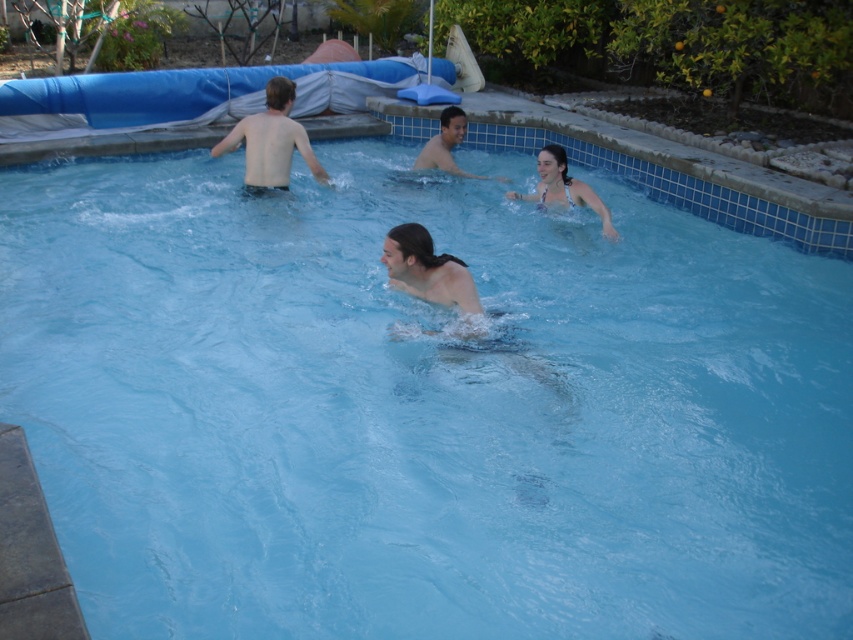
You are a photographer taking pictures of the white bikini at center and the smooth skin man at center. Which object is positioned lower in the image?

The white bikini at center is below the smooth skin man at center, so the white bikini at center is positioned lower in the image.

You are standing at the center of the pool and want to wave to the smooth skin man at upper left. In which direction should you look to see him?

The smooth skin man at upper left is located at point [271,140], so you should look towards the upper left direction to see him.